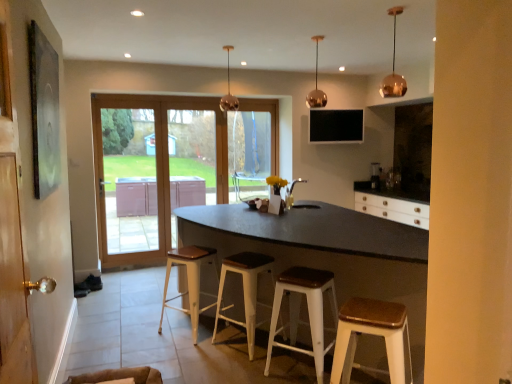
Question: Considering the relative positions of transparent glass window at center and white wood stool at lower right, placed as the 1th stool when sorted from front to back, in the image provided, is transparent glass window at center to the right of white wood stool at lower right, placed as the 1th stool when sorted from front to back, from the viewer's perspective?

Choices:
 (A) yes
 (B) no

Answer: (B)

Question: Does transparent glass window at center have a lesser width compared to white wood stool at lower right, placed as the 1th stool when sorted from front to back?

Choices:
 (A) no
 (B) yes

Answer: (B)

Question: Can you confirm if transparent glass window at center is wider than white wood stool at lower right, which ranks as the fourth stool in back-to-front order?

Choices:
 (A) no
 (B) yes

Answer: (A)

Question: Is the surface of transparent glass window at center in direct contact with white wood stool at lower right, placed as the 1th stool when sorted from front to back?

Choices:
 (A) no
 (B) yes

Answer: (A)

Question: Can you confirm if transparent glass window at center is bigger than white wood stool at lower right, which ranks as the fourth stool in back-to-front order?

Choices:
 (A) yes
 (B) no

Answer: (B)

Question: From the image's perspective, relative to matte silver sink at center, is white wood stool at lower right, which ranks as the fourth stool in back-to-front order, above or below?

Choices:
 (A) below
 (B) above

Answer: (A)

Question: Would you say white wood stool at lower right, which ranks as the fourth stool in back-to-front order, is inside or outside matte silver sink at center?

Choices:
 (A) inside
 (B) outside

Answer: (B)

Question: In terms of height, does white wood stool at lower right, placed as the 1th stool when sorted from front to back, look taller or shorter compared to matte silver sink at center?

Choices:
 (A) tall
 (B) short

Answer: (A)

Question: Looking at their shapes, would you say white wood stool at lower right, placed as the 1th stool when sorted from front to back, is wider or thinner than matte silver sink at center?

Choices:
 (A) wide
 (B) thin

Answer: (A)

Question: Is white metal stool at center, acting as the 2th stool starting from the front, inside the boundaries of black matte table at center, or outside?

Choices:
 (A) inside
 (B) outside

Answer: (A)

Question: From a real-world perspective, is white metal stool at center, the 3th stool from the back, physically located above or below black matte table at center?

Choices:
 (A) above
 (B) below

Answer: (B)

Question: Does point (313, 304) appear closer or farther from the camera than point (402, 297)?

Choices:
 (A) closer
 (B) farther

Answer: (B)

Question: Is white metal stool at center, acting as the 2th stool starting from the front, to the left or to the right of black matte table at center in the image?

Choices:
 (A) left
 (B) right

Answer: (B)

Question: In terms of width, does white wood stool at center, placed as the first stool when sorted from back to front, look wider or thinner when compared to transparent glass window at center?

Choices:
 (A) thin
 (B) wide

Answer: (B)

Question: Relative to transparent glass window at center, is white wood stool at center, placed as the fourth stool when sorted from front to back, in front or behind?

Choices:
 (A) behind
 (B) front

Answer: (B)